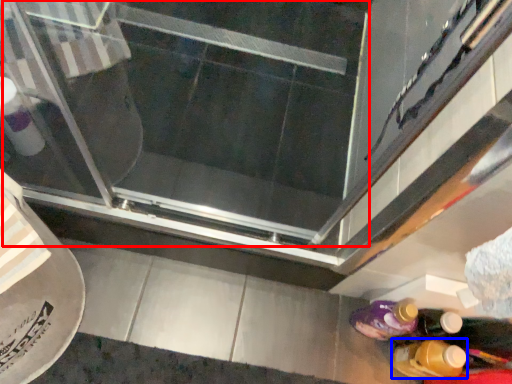
Question: Among these objects, which one is nearest to the camera, screen door (highlighted by a red box) or bottle (highlighted by a blue box)?

Choices:
 (A) screen door
 (B) bottle

Answer: (B)